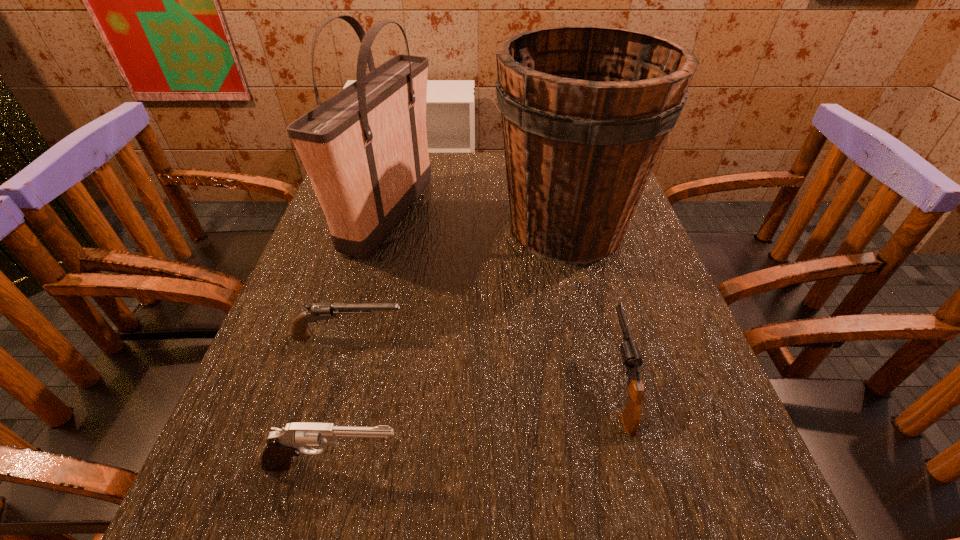
You are a GUI agent. You are given a task and a screenshot of the screen. Output one action in this format:
    pyautogui.click(x=<x>, y=<y>)
    Task: Click on the shopping bag
    Image resolution: width=960 pixels, height=540 pixels.
    Given the screenshot: What is the action you would take?
    pyautogui.click(x=365, y=149)

Where is `bucket`? The image size is (960, 540). bucket is located at coordinates (586, 110).

What are the coordinates of `the nearest object` in the screenshot? It's located at (282, 444).

What are the coordinates of `the rightmost gun` in the screenshot? It's located at (631, 416).

This screenshot has width=960, height=540. What are the coordinates of `the second nearest gun` in the screenshot? It's located at (631, 416).

This screenshot has width=960, height=540. Find the location of `the farthest gun`. the farthest gun is located at coordinates (299, 330).

Locate an element on the screen. The width and height of the screenshot is (960, 540). the shortest gun is located at coordinates (299, 330).

The image size is (960, 540). I want to click on free location located 0.050m on the right of the shopping bag, so coord(451,216).

You are a GUI agent. You are given a task and a screenshot of the screen. Output one action in this format:
    pyautogui.click(x=<x>, y=<y>)
    Task: Click on the blank area located on the back of the bucket
    
    Given the screenshot: What is the action you would take?
    pyautogui.click(x=550, y=159)

Image resolution: width=960 pixels, height=540 pixels. I want to click on vacant space situated at the muzzle of the nearest object, so click(x=622, y=465).